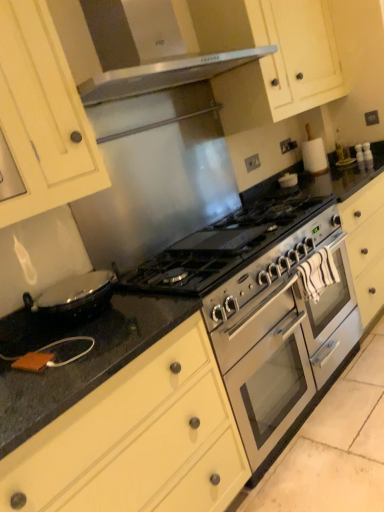
Describe the element at coordinates (279, 62) in the screenshot. The width and height of the screenshot is (384, 512). I see `matte cream cabinet at upper center, acting as the 1th cabinetry starting from the top` at that location.

This screenshot has width=384, height=512. What do you see at coordinates (43, 115) in the screenshot? I see `matte white cabinet at upper left, positioned as the 2th cabinetry in top-to-bottom order` at bounding box center [43, 115].

You are a GUI agent. You are given a task and a screenshot of the screen. Output one action in this format:
    pyautogui.click(x=<x>, y=<y>)
    Task: Click on the matte white cabinet at upper left, positioned as the 2th cabinetry in top-to-bottom order
    This screenshot has width=384, height=512.
    Given the screenshot: What is the action you would take?
    pyautogui.click(x=43, y=115)

Image resolution: width=384 pixels, height=512 pixels. Describe the element at coordinates (138, 439) in the screenshot. I see `matte cream drawer at lower left, positioned as the 1th cabinetry in bottom-to-top order` at that location.

I want to click on matte cream cabinet at upper center, acting as the 1th cabinetry starting from the top, so click(279, 62).

Who is smaller, matte cream cabinet at upper center, placed as the third cabinetry when sorted from bottom to top, or matte cream drawer at lower left, placed as the 3th cabinetry when sorted from top to bottom?

matte cream cabinet at upper center, placed as the third cabinetry when sorted from bottom to top, is smaller.

From the image's perspective, is matte cream cabinet at upper center, placed as the third cabinetry when sorted from bottom to top, located beneath matte cream drawer at lower left, placed as the 3th cabinetry when sorted from top to bottom?

No, from the image's perspective, matte cream cabinet at upper center, placed as the third cabinetry when sorted from bottom to top, is not below matte cream drawer at lower left, placed as the 3th cabinetry when sorted from top to bottom.

I want to click on the 2nd cabinetry in front of the matte cream cabinet at upper center, placed as the third cabinetry when sorted from bottom to top, starting your count from the anchor, so click(x=138, y=439).

Is matte cream cabinet at upper center, acting as the 1th cabinetry starting from the top, turned away from matte cream drawer at lower left, positioned as the 1th cabinetry in bottom-to-top order?

No, matte cream cabinet at upper center, acting as the 1th cabinetry starting from the top,'s orientation is not away from matte cream drawer at lower left, positioned as the 1th cabinetry in bottom-to-top order.

Is point (181, 465) farther from camera compared to point (218, 248)?

No, (181, 465) is closer to viewer.

Is matte cream drawer at lower left, placed as the 3th cabinetry when sorted from top to bottom, touching stainless steel gas stove at center?

matte cream drawer at lower left, placed as the 3th cabinetry when sorted from top to bottom, and stainless steel gas stove at center are clearly separated.

Do you think matte cream drawer at lower left, placed as the 3th cabinetry when sorted from top to bottom, is within stainless steel gas stove at center, or outside of it?

matte cream drawer at lower left, placed as the 3th cabinetry when sorted from top to bottom, lies outside stainless steel gas stove at center.

Who is shorter, matte cream drawer at lower left, placed as the 3th cabinetry when sorted from top to bottom, or stainless steel gas stove at center?

stainless steel gas stove at center is shorter.

From the image's perspective, which one is positioned higher, matte white cabinet at upper left, the 2th cabinetry from the bottom, or matte cream drawer at lower left, placed as the 3th cabinetry when sorted from top to bottom?

matte white cabinet at upper left, the 2th cabinetry from the bottom.

Is matte white cabinet at upper left, positioned as the 2th cabinetry in top-to-bottom order, thinner than matte cream drawer at lower left, placed as the 3th cabinetry when sorted from top to bottom?

Yes.

Is matte white cabinet at upper left, the 2th cabinetry from the bottom, placed right next to matte cream drawer at lower left, placed as the 3th cabinetry when sorted from top to bottom?

No, matte white cabinet at upper left, the 2th cabinetry from the bottom, is not in contact with matte cream drawer at lower left, placed as the 3th cabinetry when sorted from top to bottom.

Between matte white cabinet at upper left, the 2th cabinetry from the bottom, and matte cream drawer at lower left, positioned as the 1th cabinetry in bottom-to-top order, which one has larger size?

Bigger between the two is matte cream drawer at lower left, positioned as the 1th cabinetry in bottom-to-top order.

Can you tell me how much matte white cabinet at upper left, positioned as the 2th cabinetry in top-to-bottom order, and matte cream cabinet at upper center, placed as the third cabinetry when sorted from bottom to top, differ in facing direction?

1.94 degrees.

Based on their sizes in the image, would you say matte white cabinet at upper left, positioned as the 2th cabinetry in top-to-bottom order, is bigger or smaller than matte cream cabinet at upper center, placed as the third cabinetry when sorted from bottom to top?

Considering their sizes, matte white cabinet at upper left, positioned as the 2th cabinetry in top-to-bottom order, takes up less space than matte cream cabinet at upper center, placed as the third cabinetry when sorted from bottom to top.

Consider the image. Between matte white cabinet at upper left, the 2th cabinetry from the bottom, and matte cream cabinet at upper center, acting as the 1th cabinetry starting from the top, which one has larger width?

matte cream cabinet at upper center, acting as the 1th cabinetry starting from the top, is wider.

Is stainless steel oven at center positioned in front of stainless steel gas stove at center?

No, stainless steel oven at center is behind stainless steel gas stove at center.

Which of these two, stainless steel oven at center or stainless steel gas stove at center, stands taller?

With more height is stainless steel oven at center.

From the image's perspective, relative to stainless steel gas stove at center, is stainless steel oven at center above or below?

stainless steel oven at center is below stainless steel gas stove at center.

Is stainless steel oven at center completely or partially outside of stainless steel gas stove at center?

Yes.

Consider the image. Is matte cream cabinet at upper center, placed as the third cabinetry when sorted from bottom to top, bigger than stainless steel oven at center?

No.

Is there a large distance between matte cream cabinet at upper center, placed as the third cabinetry when sorted from bottom to top, and stainless steel oven at center?

Indeed, matte cream cabinet at upper center, placed as the third cabinetry when sorted from bottom to top, is not near stainless steel oven at center.

Is matte cream cabinet at upper center, acting as the 1th cabinetry starting from the top, aimed at stainless steel oven at center?

No, matte cream cabinet at upper center, acting as the 1th cabinetry starting from the top, is not aimed at stainless steel oven at center.

Does stainless steel gas stove at center have a greater width compared to matte white cabinet at upper left, positioned as the 2th cabinetry in top-to-bottom order?

Correct, the width of stainless steel gas stove at center exceeds that of matte white cabinet at upper left, positioned as the 2th cabinetry in top-to-bottom order.

From a real-world perspective, is stainless steel gas stove at center positioned over matte white cabinet at upper left, positioned as the 2th cabinetry in top-to-bottom order, based on gravity?

No, from a real-world perspective, stainless steel gas stove at center is not above matte white cabinet at upper left, positioned as the 2th cabinetry in top-to-bottom order.

Which object is positioned more to the left, stainless steel gas stove at center or matte white cabinet at upper left, positioned as the 2th cabinetry in top-to-bottom order?

Positioned to the left is matte white cabinet at upper left, positioned as the 2th cabinetry in top-to-bottom order.

From the image's perspective, would you say stainless steel gas stove at center is shown under matte white cabinet at upper left, the 2th cabinetry from the bottom?

Correct, stainless steel gas stove at center appears lower than matte white cabinet at upper left, the 2th cabinetry from the bottom, in the image.

This screenshot has height=512, width=384. What are the coordinates of `the 2nd cabinetry behind the matte cream drawer at lower left, positioned as the 1th cabinetry in bottom-to-top order, starting your count from the anchor` in the screenshot? It's located at (279, 62).

Find the location of a particular element. cabinetry below the stainless steel gas stove at center (from the image's perspective) is located at coordinates (138, 439).

From the image, which object appears to be farther from matte cream cabinet at upper center, placed as the third cabinetry when sorted from bottom to top, matte white cabinet at upper left, positioned as the 2th cabinetry in top-to-bottom order, or stainless steel gas stove at center?

Based on the image, matte white cabinet at upper left, positioned as the 2th cabinetry in top-to-bottom order, appears to be further to matte cream cabinet at upper center, placed as the third cabinetry when sorted from bottom to top.

Which object lies further to the anchor point stainless steel oven at center, matte white cabinet at upper left, positioned as the 2th cabinetry in top-to-bottom order, or matte cream drawer at lower left, positioned as the 1th cabinetry in bottom-to-top order?

matte white cabinet at upper left, positioned as the 2th cabinetry in top-to-bottom order.

Estimate the real-world distances between objects in this image. Which object is further from stainless steel oven at center, stainless steel gas stove at center or matte white cabinet at upper left, positioned as the 2th cabinetry in top-to-bottom order?

matte white cabinet at upper left, positioned as the 2th cabinetry in top-to-bottom order, is further to stainless steel oven at center.

Considering their positions, is matte cream cabinet at upper center, placed as the third cabinetry when sorted from bottom to top, positioned closer to matte cream drawer at lower left, placed as the 3th cabinetry when sorted from top to bottom, than stainless steel gas stove at center?

The object closer to matte cream drawer at lower left, placed as the 3th cabinetry when sorted from top to bottom, is stainless steel gas stove at center.

From the image, which object appears to be farther from matte cream drawer at lower left, positioned as the 1th cabinetry in bottom-to-top order, stainless steel gas stove at center or matte white cabinet at upper left, the 2th cabinetry from the bottom?

matte white cabinet at upper left, the 2th cabinetry from the bottom.

Which object lies nearer to the anchor point matte cream drawer at lower left, placed as the 3th cabinetry when sorted from top to bottom, matte white cabinet at upper left, positioned as the 2th cabinetry in top-to-bottom order, or stainless steel gas stove at center?

The object closer to matte cream drawer at lower left, placed as the 3th cabinetry when sorted from top to bottom, is stainless steel gas stove at center.

When comparing their distances from stainless steel oven at center, does matte white cabinet at upper left, positioned as the 2th cabinetry in top-to-bottom order, or matte cream cabinet at upper center, acting as the 1th cabinetry starting from the top, seem closer?

Based on the image, matte white cabinet at upper left, positioned as the 2th cabinetry in top-to-bottom order, appears to be nearer to stainless steel oven at center.

Based on their spatial positions, is matte cream drawer at lower left, placed as the 3th cabinetry when sorted from top to bottom, or matte white cabinet at upper left, the 2th cabinetry from the bottom, further from stainless steel oven at center?

The object further to stainless steel oven at center is matte white cabinet at upper left, the 2th cabinetry from the bottom.

Locate an element on the screen. The width and height of the screenshot is (384, 512). gas stove between matte white cabinet at upper left, the 2th cabinetry from the bottom, and matte cream drawer at lower left, placed as the 3th cabinetry when sorted from top to bottom, in the up-down direction is located at coordinates (222, 246).

Where is `gas stove between matte cream cabinet at upper center, acting as the 1th cabinetry starting from the top, and stainless steel oven at center in the up-down direction`? gas stove between matte cream cabinet at upper center, acting as the 1th cabinetry starting from the top, and stainless steel oven at center in the up-down direction is located at coordinates (222, 246).

Locate an element on the screen. The image size is (384, 512). oven between stainless steel gas stove at center and matte cream drawer at lower left, placed as the 3th cabinetry when sorted from top to bottom, from top to bottom is located at coordinates (281, 349).

Image resolution: width=384 pixels, height=512 pixels. I want to click on gas stove between matte cream cabinet at upper center, placed as the third cabinetry when sorted from bottom to top, and matte cream drawer at lower left, placed as the 3th cabinetry when sorted from top to bottom, vertically, so click(222, 246).